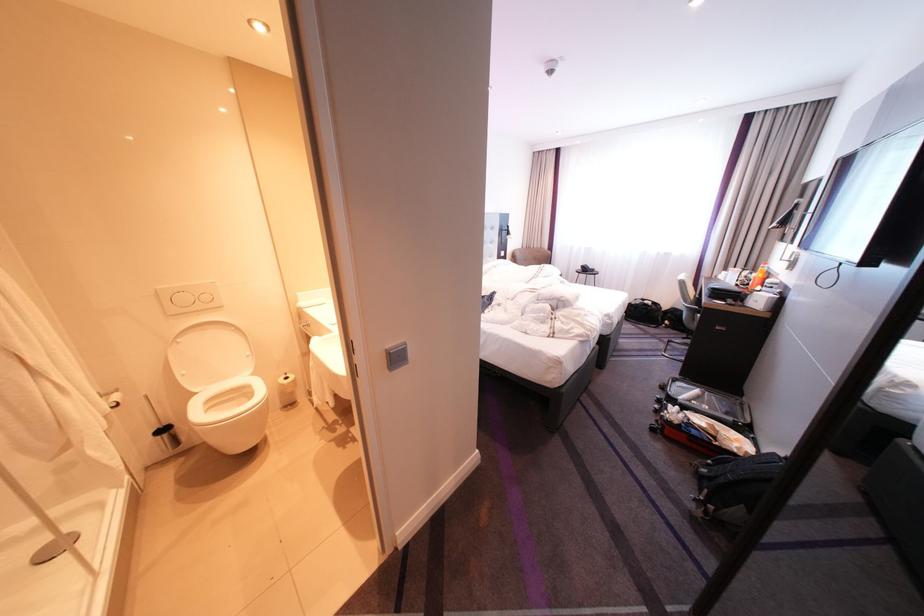
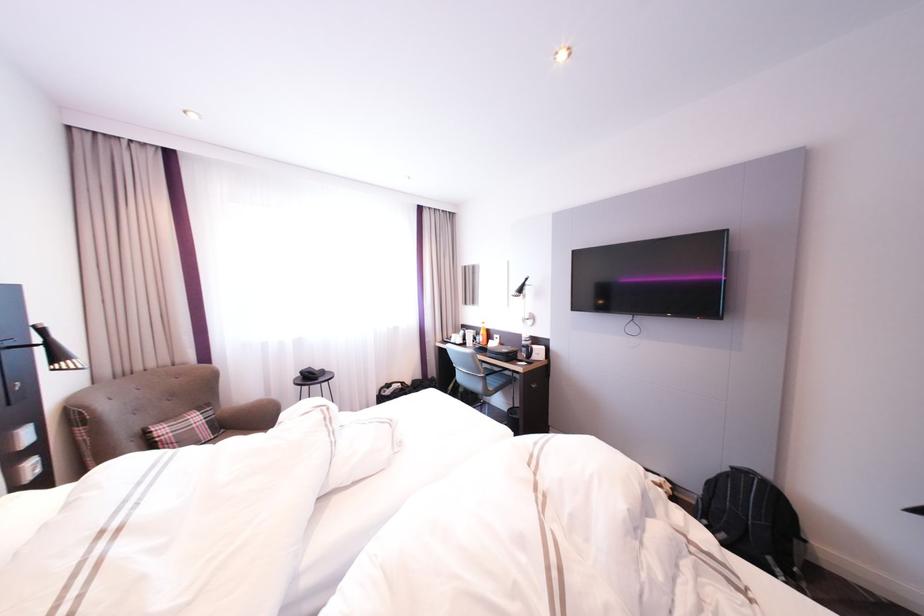
Find the pixel in the second image that matches [654,301] in the first image.

(400, 386)